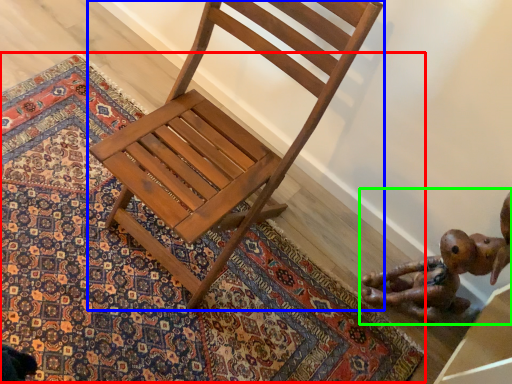
Question: Which is farther away from mat (highlighted by a red box)? chair (highlighted by a blue box) or toy (highlighted by a green box)?

Choices:
 (A) chair
 (B) toy

Answer: (B)